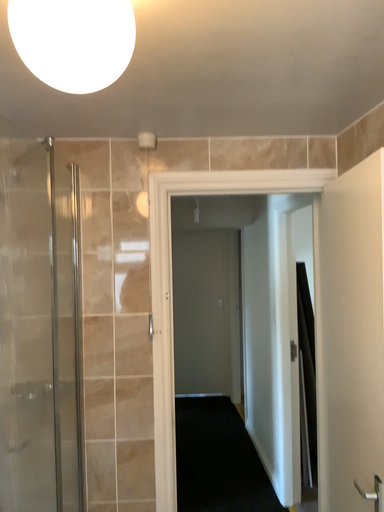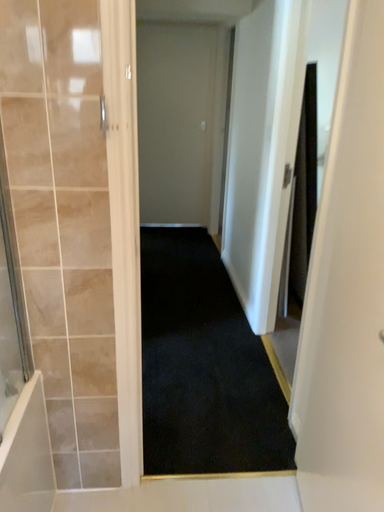
Question: How did the camera likely rotate when shooting the video?

Choices:
 (A) rotated downward
 (B) rotated upward

Answer: (A)